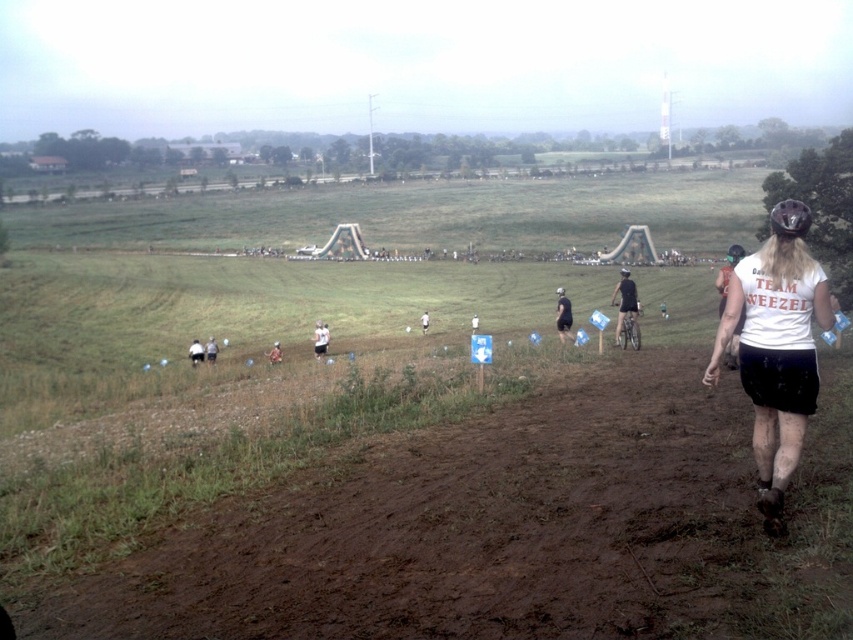
Question: Which object is positioned farthest from the white cotton shirt at lower left?

Choices:
 (A) red fabric person at center
 (B) white matte helmet at upper center
 (C) white cotton shirt at center

Answer: (B)

Question: Which point appears farthest from the camera in this image?

Choices:
 (A) (561, 291)
 (B) (772, 426)
 (C) (798, 218)

Answer: (A)

Question: In this image, where is white cotton shirt at right located relative to white cotton shirt at center?

Choices:
 (A) below
 (B) above

Answer: (A)

Question: Can you confirm if white fabric shirt at center is positioned below white cotton shirt at lower left?

Choices:
 (A) no
 (B) yes

Answer: (A)

Question: Is matte black bicycle at center in front of black matte person at center?

Choices:
 (A) yes
 (B) no

Answer: (A)

Question: Which point is closer to the camera taking this photo?

Choices:
 (A) (567, 301)
 (B) (625, 314)

Answer: (B)